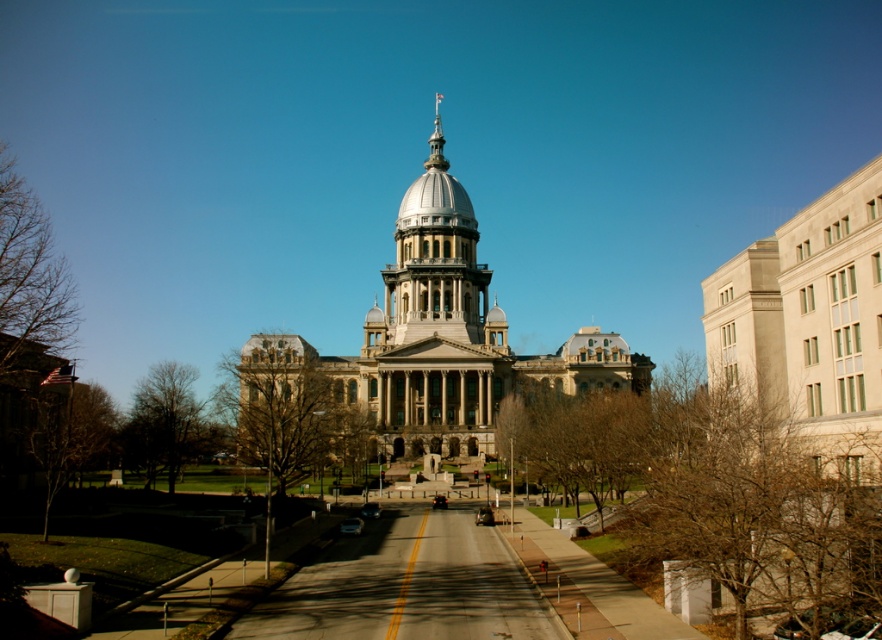
Question: Which of the following is the closest to the observer?

Choices:
 (A) coord(432,161)
 (B) coord(348,531)

Answer: (B)

Question: Which of the following is the closest to the observer?

Choices:
 (A) black glossy car at center
 (B) white marble dome at center
 (C) beige stone tower at center
 (D) metallic silver car at center

Answer: (D)

Question: Is beige stone tower at center wider than polished silver spire at center top?

Choices:
 (A) no
 (B) yes

Answer: (B)

Question: Is shiny black sedan at center positioned before black glossy car at center?

Choices:
 (A) no
 (B) yes

Answer: (B)

Question: Does white marble dome at center have a greater width compared to black glossy car at center?

Choices:
 (A) no
 (B) yes

Answer: (B)

Question: Which object is closer to the camera taking this photo?

Choices:
 (A) polished silver spire at center top
 (B) beige stone tower at center
 (C) white marble dome at center

Answer: (B)